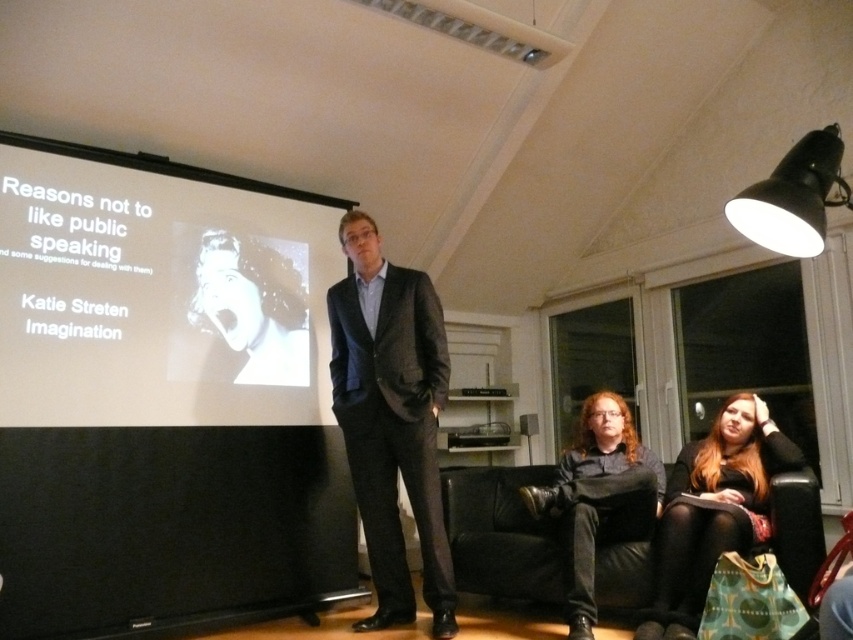
You are a photographer taking a group photo of the people in the scene. You need to ensure that both the long brown hair at lower right and the dark brown leather jacket at lower center are clearly visible. Which object should you focus on first to ensure it is in sharp focus?

You should focus on the dark brown leather jacket at lower center first because it is larger than the long brown hair at lower right, making it easier to capture in sharp focus.

You are an interior designer planning to replace the white matte projection screen at upper left and the matte black suit at center with new items. If you want to maintain the current spatial balance, which item should you choose to be wider when selecting replacements?

The white matte projection screen at upper left is wider than the matte black suit at center. To maintain spatial balance, you should choose a wider replacement for the matte black suit at center so that it matches the width of the white matte projection screen at upper left.